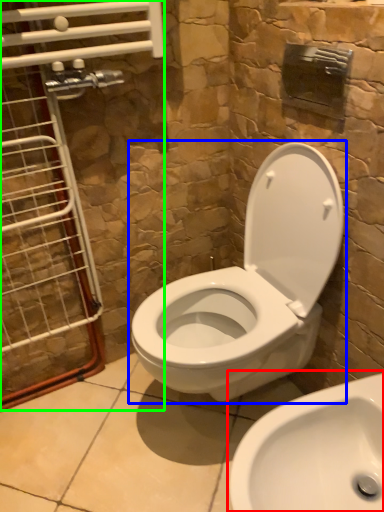
Question: Based on their relative distances, which object is farther from sink (highlighted by a red box)? Choose from toilet (highlighted by a blue box) and glass door (highlighted by a green box).

Choices:
 (A) toilet
 (B) glass door

Answer: (B)